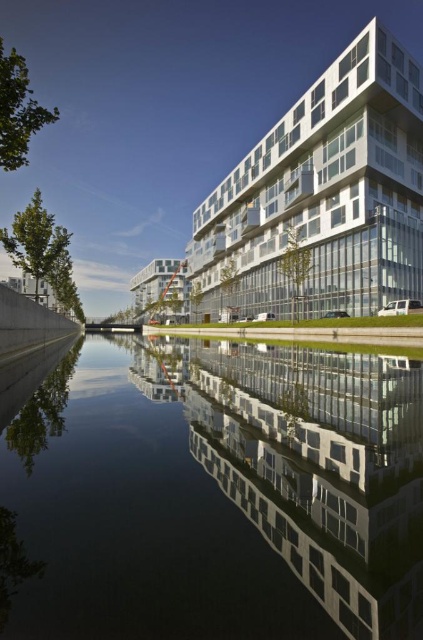
Is the position of transparent glass waterway at center more distant than that of white glass building at upper center?

That is False.

Is point (8, 474) farther from viewer compared to point (320, 200)?

No, (8, 474) is in front of (320, 200).

The image size is (423, 640). Describe the element at coordinates (219, 493) in the screenshot. I see `transparent glass waterway at center` at that location.

Locate an element on the screen. transparent glass waterway at center is located at coordinates (219, 493).